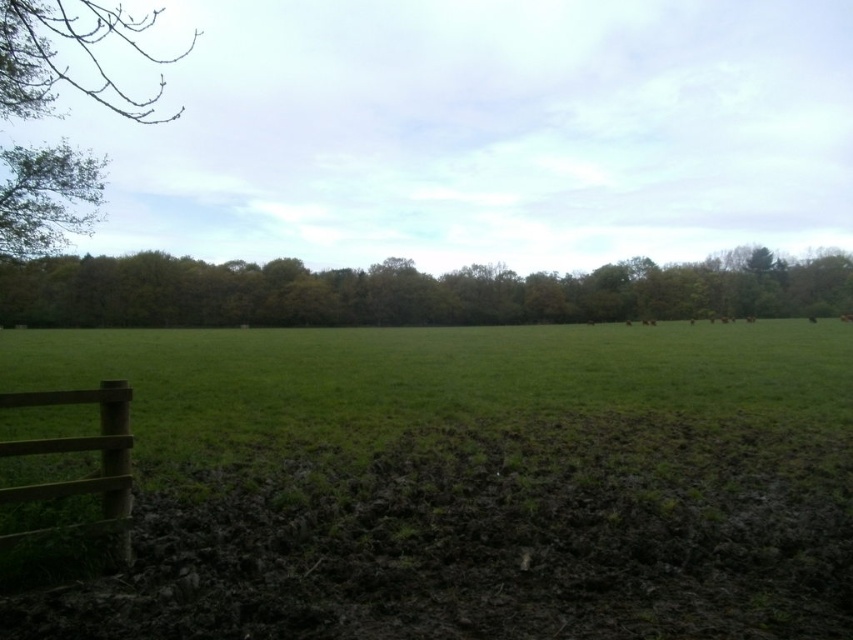
Does green leafy tree at upper left have a lesser width compared to brown wooden fence at lower left?

In fact, green leafy tree at upper left might be wider than brown wooden fence at lower left.

The image size is (853, 640). What do you see at coordinates (68, 64) in the screenshot?
I see `green leafy tree at upper left` at bounding box center [68, 64].

Is point (20, 180) positioned behind point (125, 460)?

Yes, point (20, 180) is farther from viewer.

Where is `green leafy tree at upper left`? green leafy tree at upper left is located at coordinates (68, 64).

Between point (213, 324) and point (62, 397), which one is positioned behind?

Point (213, 324)

Is green leafy trees at upper center positioned at the back of brown wooden fence at lower left?

Yes, green leafy trees at upper center is further from the viewer.

Measure the distance between point (666,316) and camera.

99.31 meters

Locate an element on the screen. This screenshot has width=853, height=640. green leafy trees at upper center is located at coordinates (405, 292).

Measure the distance from green leafy trees at upper center to green leafy tree at upper left.

green leafy trees at upper center is 63.70 meters from green leafy tree at upper left.

The image size is (853, 640). What do you see at coordinates (405, 292) in the screenshot?
I see `green leafy trees at upper center` at bounding box center [405, 292].

This screenshot has width=853, height=640. What do you see at coordinates (405, 292) in the screenshot?
I see `green leafy trees at upper center` at bounding box center [405, 292].

Locate an element on the screen. This screenshot has width=853, height=640. green leafy trees at upper center is located at coordinates (405, 292).